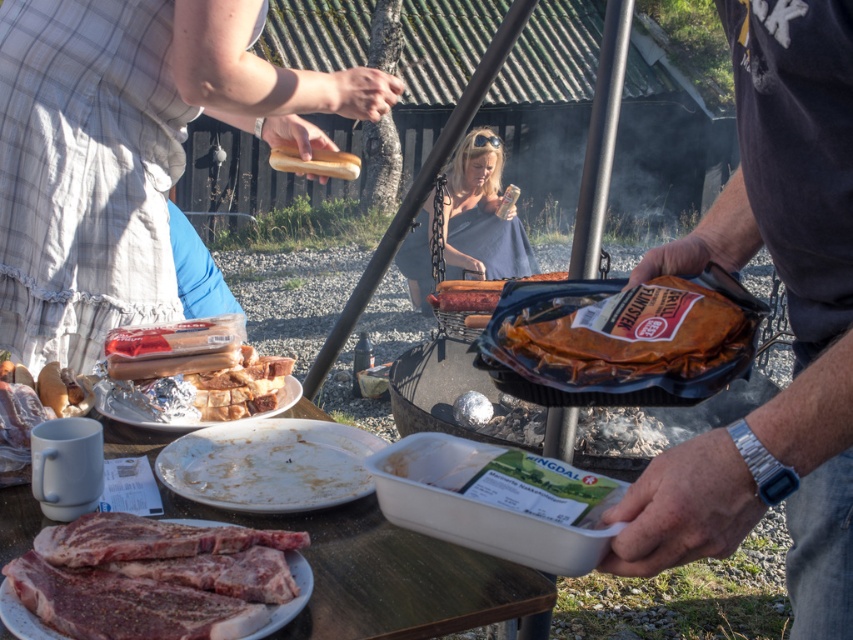
Between gray matte dress at center and brown paper wrapped meat at center, which one is positioned lower?

brown paper wrapped meat at center is lower down.

Is gray matte dress at center bigger than brown paper wrapped meat at center?

Yes, gray matte dress at center is bigger than brown paper wrapped meat at center.

The width and height of the screenshot is (853, 640). Find the location of `gray matte dress at center`. gray matte dress at center is located at coordinates click(x=480, y=214).

The width and height of the screenshot is (853, 640). I want to click on gray matte dress at center, so pos(480,214).

Is the position of translucent plastic hot dogs at lower left more distant than that of gray matte dress at center?

No.

Is translucent plastic hot dogs at lower left bigger than gray matte dress at center?

Incorrect, translucent plastic hot dogs at lower left is not larger than gray matte dress at center.

Is point (277, 378) behind point (485, 196)?

No, (277, 378) is closer to viewer.

The image size is (853, 640). Find the location of `translucent plastic hot dogs at lower left`. translucent plastic hot dogs at lower left is located at coordinates (200, 364).

Which is more to the right, light gray cotton apron at left or dark gray fabric shirt at center?

Positioned to the right is dark gray fabric shirt at center.

Does light gray cotton apron at left lie in front of dark gray fabric shirt at center?

No, it is behind dark gray fabric shirt at center.

Does point (18, 188) lie behind point (724, 218)?

Yes, it is.

Find the location of `light gray cotton apron at left`. light gray cotton apron at left is located at coordinates (126, 150).